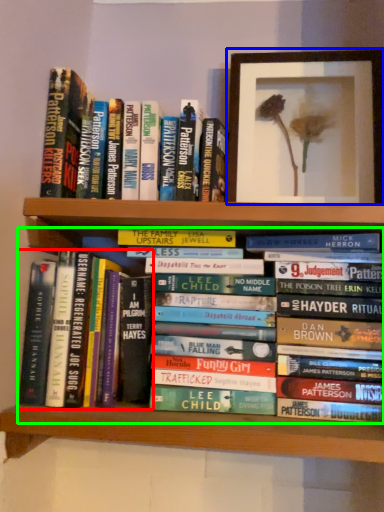
Question: Estimate the real-world distances between objects in this image. Which object is farther from book (highlighted by a red box), picture frame (highlighted by a blue box) or book (highlighted by a green box)?

Choices:
 (A) picture frame
 (B) book

Answer: (A)